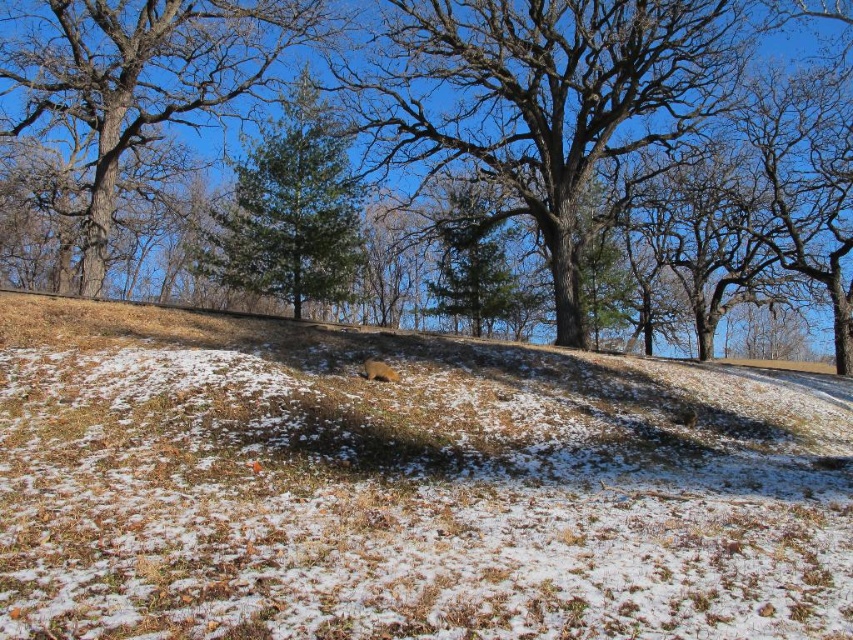
You are standing in the winter landscape and want to walk from the point at coordinates [195,122] to the point at [289,250]. Which direction should you move to get closer to your destination?

You should move away from the viewer because point [195,122] is closer to the viewer than point [289,250]. Moving away from the viewer will take you towards the destination.

You are an artist planning to paint the winter landscape. You want to ensure the brown textured tree at center and the green pine tree at center are proportionally accurate. Which tree should you paint larger?

The brown textured tree at center should be painted larger since it is bigger than the green pine tree at center according to the description.